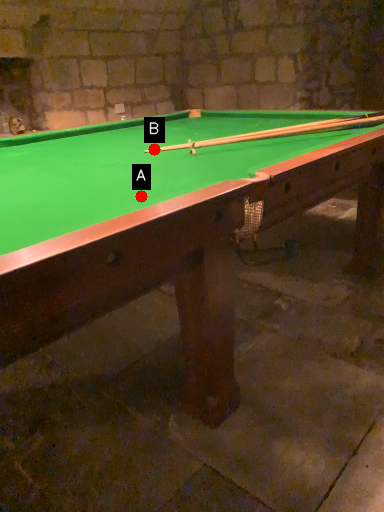
Question: Two points are circled on the image, labeled by A and B beside each circle. Which point appears farthest from the camera in this image?

Choices:
 (A) A is further
 (B) B is further

Answer: (B)